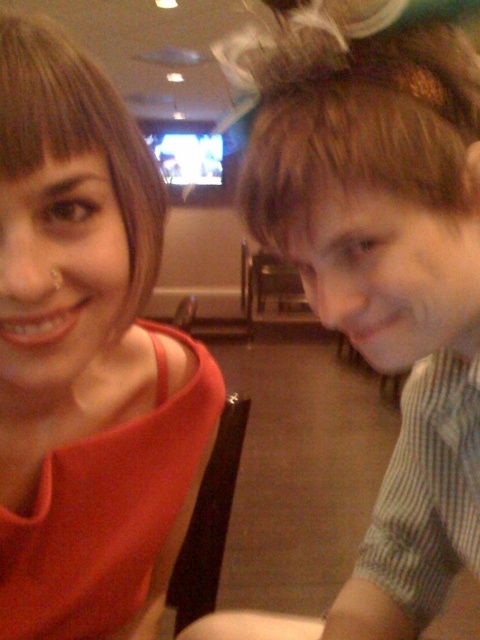
You are trying to locate the striped cotton shirt at right in the image. According to the coordinates provided, where exactly is it positioned?

The striped cotton shirt at right is positioned at coordinates point (376, 275).

You are standing in a dimly lit room with two people seated. There are two points marked in the image. The first point is at coordinates point (439, 211) and the second is at point (75, 413). Which point is nearer to you?

Point (439, 211) is closer to the viewer than point (75, 413).

You are a photographer setting up a camera at eye level. You need to ensure both the striped cotton shirt at right and the matte red dress at upper left are fully visible in the frame. Which object should you position closer to the camera to achieve this?

The striped cotton shirt at right is taller than the matte red dress at upper left. To ensure both are fully visible, position the striped cotton shirt at right closer to the camera so its height doesn not block the view of the shorter matte red dress at upper left.